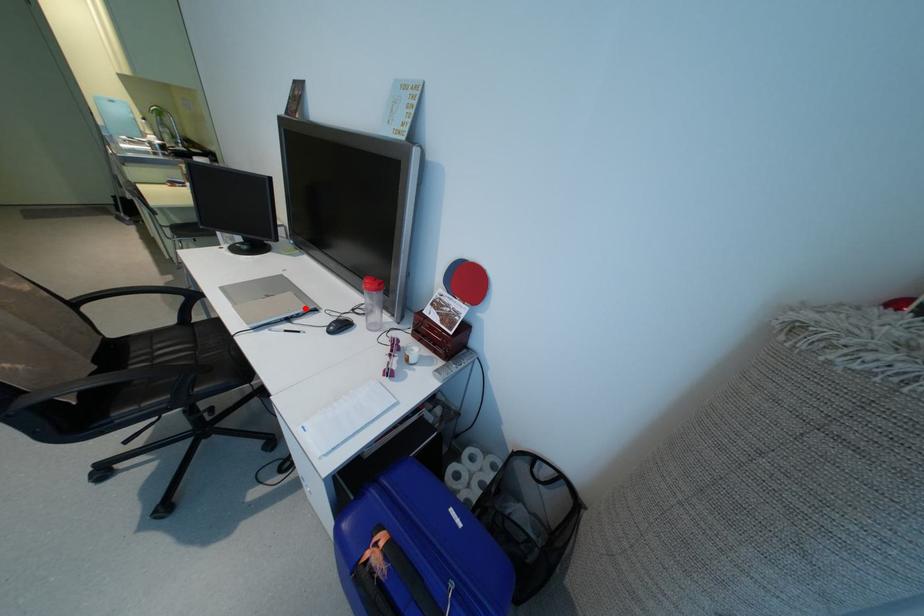
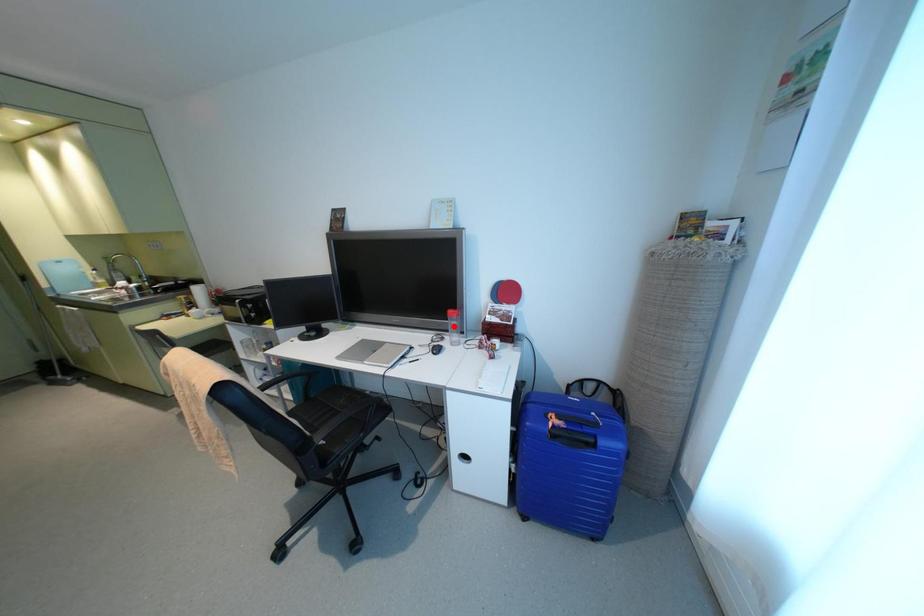
I am providing you with two images of the same scene from different viewpoints. A red point is marked on the first image and another point is marked on the second image. Is the marked point in image1 the same physical position as the marked point in image2?

No